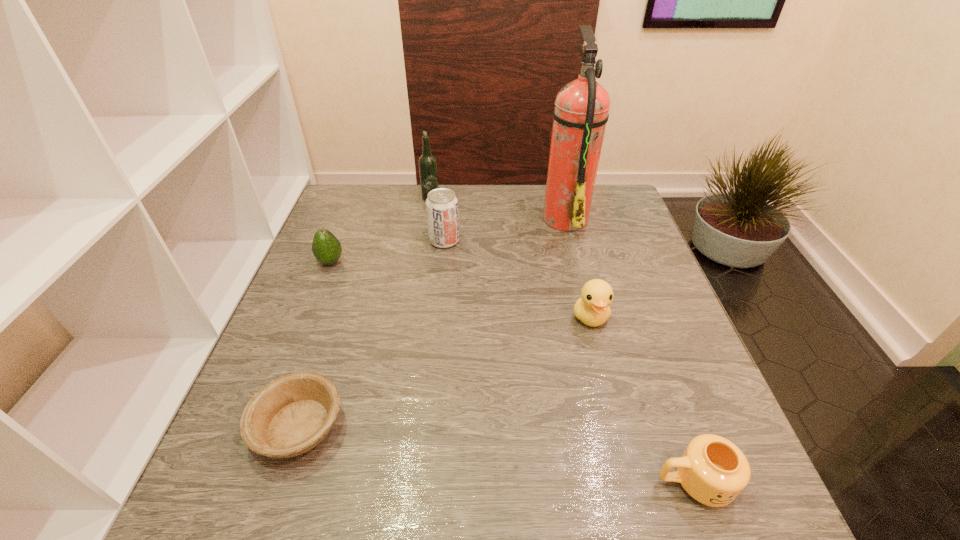
Image resolution: width=960 pixels, height=540 pixels. I want to click on mug that is at the near edge, so click(x=713, y=470).

Locate an element on the screen. This screenshot has height=540, width=960. bowl that is at the near edge is located at coordinates (291, 415).

This screenshot has height=540, width=960. Identify the location of avocado at the left edge. (326, 248).

Image resolution: width=960 pixels, height=540 pixels. What are the coordinates of `bowl that is positioned at the left edge` in the screenshot? It's located at (291, 415).

Find the location of a particular element. The width and height of the screenshot is (960, 540). fire extinguisher present at the right edge is located at coordinates (581, 112).

Identify the location of duck that is positioned at the right edge. (592, 308).

What are the coordinates of `mug at the right edge` in the screenshot? It's located at (713, 470).

Locate an element on the screen. This screenshot has height=540, width=960. object at the near left corner is located at coordinates (291, 415).

Locate an element on the screen. Image resolution: width=960 pixels, height=540 pixels. object present at the far right corner is located at coordinates (581, 112).

Locate an element on the screen. object that is at the near right corner is located at coordinates (713, 470).